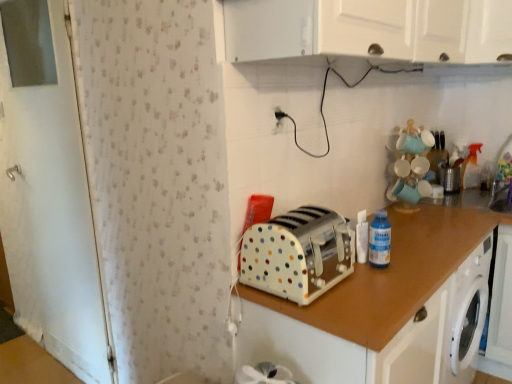
Locate an element on the screen. The height and width of the screenshot is (384, 512). free space to the left of blue plastic bottle at upper right is located at coordinates (352, 273).